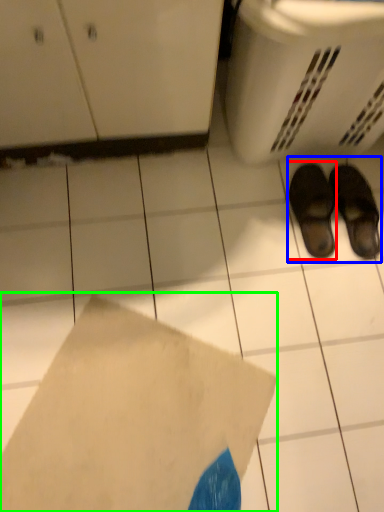
Question: Which object is the farthest from footwear (highlighted by a red box)? Choose among these: footwear (highlighted by a blue box) or envelope (highlighted by a green box).

Choices:
 (A) footwear
 (B) envelope

Answer: (B)